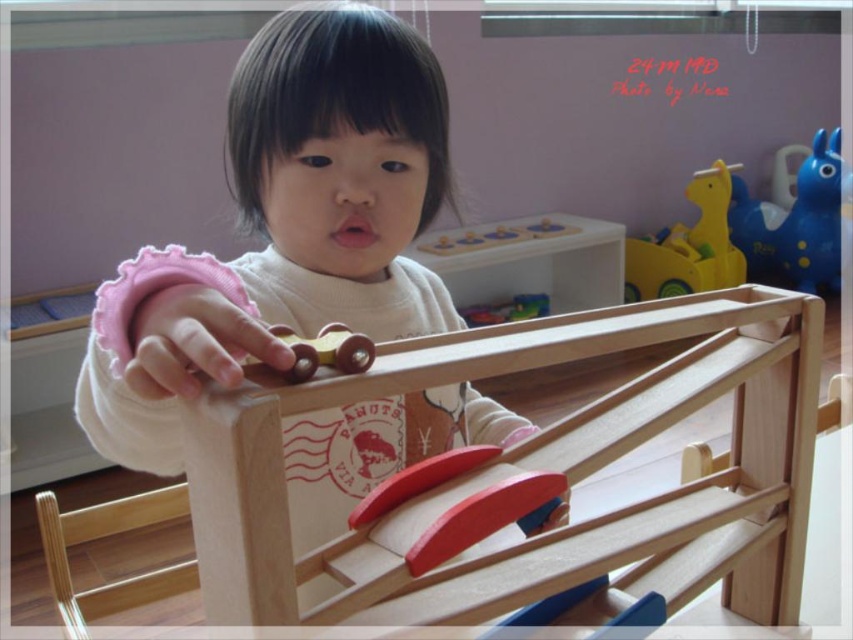
You are a parent trying to organize the child play area. The wooden car at center and the wooden toy car at center are both on the race track. How far apart are they from each other?

The wooden car at center and the wooden toy car at center are 8.49 feet apart.

You are a parent observing your child playing with the wooden toy car at center and the blue rubber horse at upper right. Which toy is taller?

The blue rubber horse at upper right is much taller than the wooden toy car at center.

You are helping a child organize their toy race track. You have two cars, the wooden car at center and the wooden toy car at center. The child wants to know which one is thinner. Can you tell them?

The wooden car at center is thinner than the wooden toy car at center according to the description.